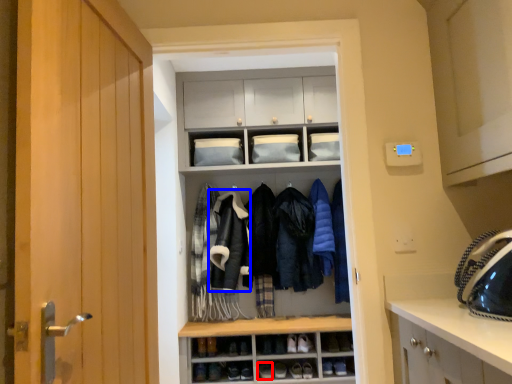
Question: Which object is further to the camera taking this photo, shoe (highlighted by a red box) or sweatshirt (highlighted by a blue box)?

Choices:
 (A) shoe
 (B) sweatshirt

Answer: (B)